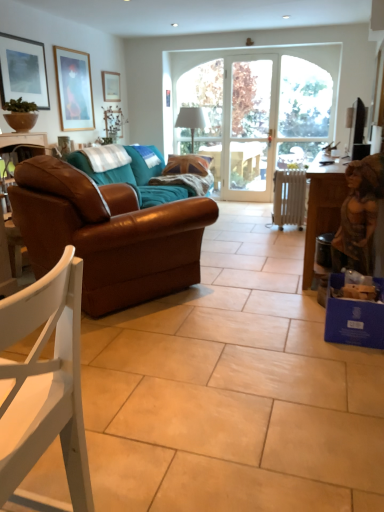
Where is `vacant space to the right of brown leather couch at left`? vacant space to the right of brown leather couch at left is located at coordinates (255, 275).